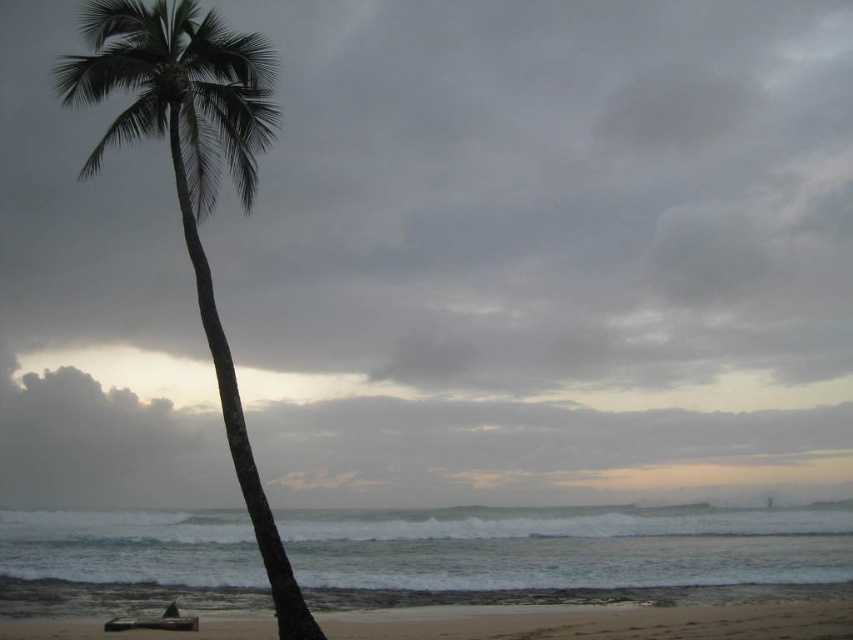
Question: Among these objects, which one is nearest to the camera?

Choices:
 (A) green leafy palm tree at left
 (B) beige sandy beach at lower center

Answer: (A)

Question: In this image, where is green leafy palm tree at left located relative to beige sandy beach at lower center?

Choices:
 (A) above
 (B) below

Answer: (A)

Question: Which of the following is the farthest from the observer?

Choices:
 (A) (506, 605)
 (B) (242, 432)

Answer: (A)

Question: Can you confirm if green leafy palm tree at left is positioned to the right of beige sandy beach at lower center?

Choices:
 (A) yes
 (B) no

Answer: (B)

Question: Among these points, which one is farthest from the camera?

Choices:
 (A) (827, 620)
 (B) (271, 67)

Answer: (B)

Question: Can you confirm if green leafy palm tree at left is bigger than beige sandy beach at lower center?

Choices:
 (A) yes
 (B) no

Answer: (A)